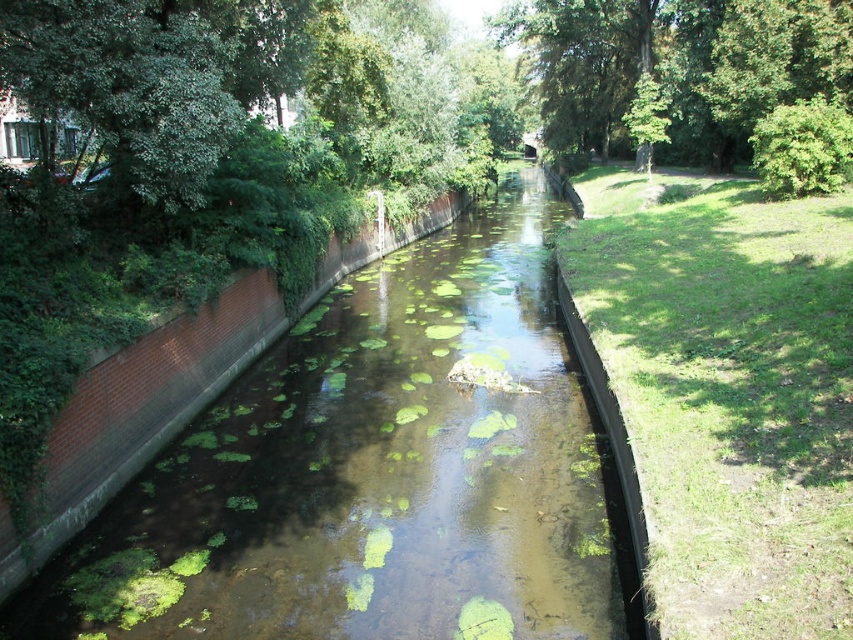
You are a drone operator trying to capture a photo of the canal. You need to ensure that both the point at coordinates point (x=738, y=28) and the point at coordinates point (x=117, y=16) are in focus. Which point should you focus on first to ensure both are sharp?

You should focus on point (x=117, y=16) first because it is closer to the camera than point (x=738, y=28). By focusing on the closer point, the further point will also be within the depth of field, ensuring both are sharp.

Please provide the 2D coordinates of the green grass at right in the scene described.

The 2D coordinates of the green grass at right are at point (728, 394).

You are a gardener who needs to water both the green grass at right and the green leafy tree at upper left. The watering can you have can cover a distance of 8 meters. Can you water both areas without moving the can? Please explain your reasoning based on the distance between them.

The green grass at right and the green leafy tree at upper left are 8.30 meters apart. Since the watering can can only cover 8 meters, you cannot water both areas without moving the can because the distance exceeds the can reach.